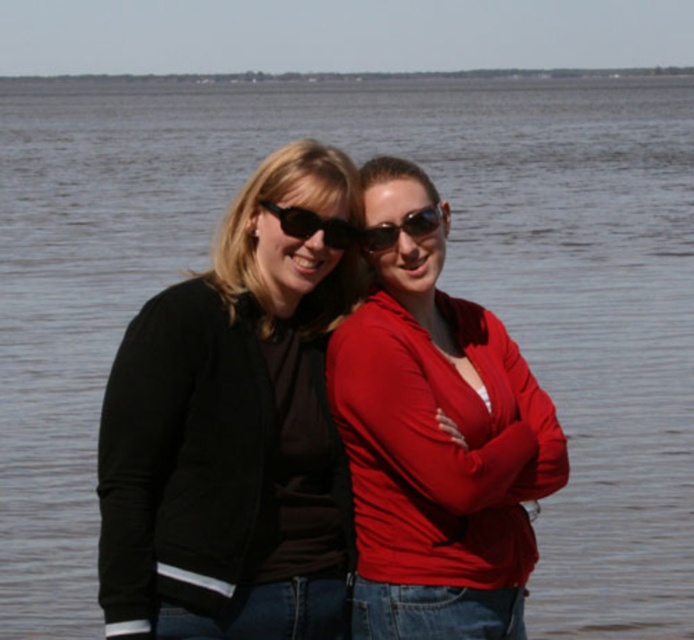
You are a photographer trying to capture a closeup of the black plastic sunglasses at center. You notice the black matte jacket at left is blocking part of the view. Which object should you move to the right to get a clearer shot of the sunglasses?

The black matte jacket at left is positioned on the left side of the black plastic sunglasses at center. To get a clearer shot of the black plastic sunglasses at center, you should move the black matte jacket at left to the right.

You are standing in the scene and want to locate the matte red jacket at center. What are the coordinates where it can be found?

The matte red jacket at center can be found at coordinates point (437, 440).

You are a photographer standing at the edge of the water. You need to adjust your camera to capture both the black matte jacket at left and the matte red jacket at center in the frame. Based on their positions, which jacket should you focus on first to ensure both are in focus?

The black matte jacket at left is located below the matte red jacket at center, so you should focus on the matte red jacket at center first as it is higher in the frame, ensuring both jackets are within the camera focus range.